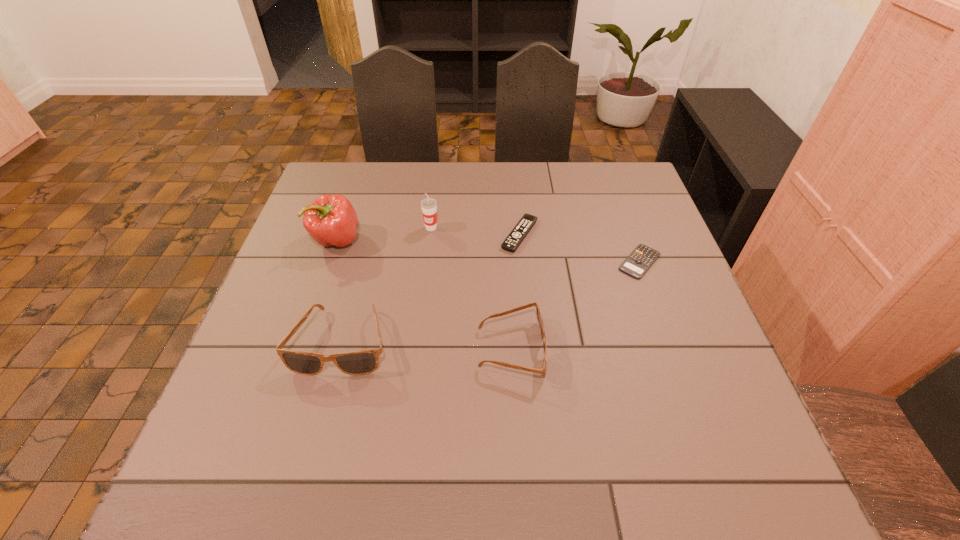
This screenshot has width=960, height=540. Identify the location of the left sunglasses. (362, 362).

Image resolution: width=960 pixels, height=540 pixels. I want to click on the taller sunglasses, so click(x=362, y=362).

The height and width of the screenshot is (540, 960). In order to click on the shorter sunglasses in this screenshot , I will do `click(539, 316)`.

Find the location of a particular element. Image resolution: width=960 pixels, height=540 pixels. the right sunglasses is located at coordinates (539, 316).

Where is `the shortest object`? This screenshot has width=960, height=540. the shortest object is located at coordinates (640, 260).

I want to click on calculator, so click(x=640, y=260).

You are a GUI agent. You are given a task and a screenshot of the screen. Output one action in this format:
    pyautogui.click(x=<x>, y=<y>)
    Task: Click on the fourth object from right to left
    The height and width of the screenshot is (540, 960).
    Given the screenshot: What is the action you would take?
    pyautogui.click(x=428, y=205)

Find the location of `the fifth tallest object`. the fifth tallest object is located at coordinates (513, 240).

You are a GUI agent. You are given a task and a screenshot of the screen. Output one action in this format:
    pyautogui.click(x=<x>, y=<y>)
    Task: Click on the pepper
    
    Given the screenshot: What is the action you would take?
    pyautogui.click(x=331, y=220)

This screenshot has height=540, width=960. What are the coordinates of `free point located on the frames of the right sunglasses` in the screenshot? It's located at (582, 349).